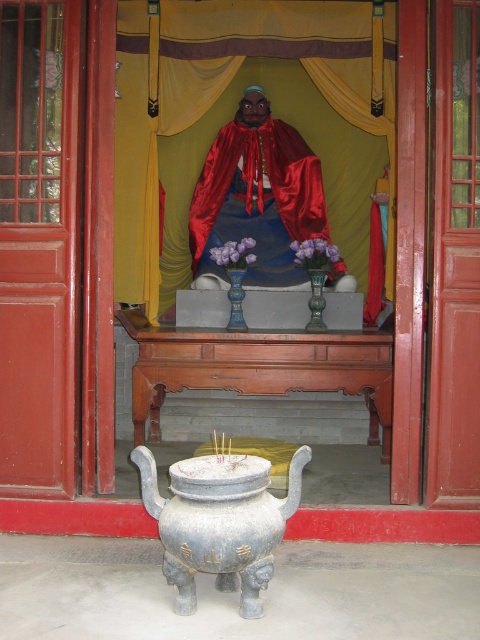
Question: Which of the following is the farthest from the observer?

Choices:
 (A) tap(265, 577)
 (B) tap(298, 150)
 (C) tap(194, 371)

Answer: (B)

Question: Can you confirm if wooden altar at center is smaller than shiny red fabric monk at center?

Choices:
 (A) yes
 (B) no

Answer: (B)

Question: Which point is farther to the camera?

Choices:
 (A) (315, 221)
 (B) (175, 492)
 (C) (233, 387)

Answer: (A)

Question: Considering the real-world distances, which object is closest to the wooden altar at center?

Choices:
 (A) gray stone incense burner at center
 (B) shiny red fabric monk at center

Answer: (B)

Question: Is wooden altar at center further to camera compared to shiny red fabric monk at center?

Choices:
 (A) no
 (B) yes

Answer: (A)

Question: Is the position of wooden altar at center more distant than that of shiny red fabric monk at center?

Choices:
 (A) no
 (B) yes

Answer: (A)